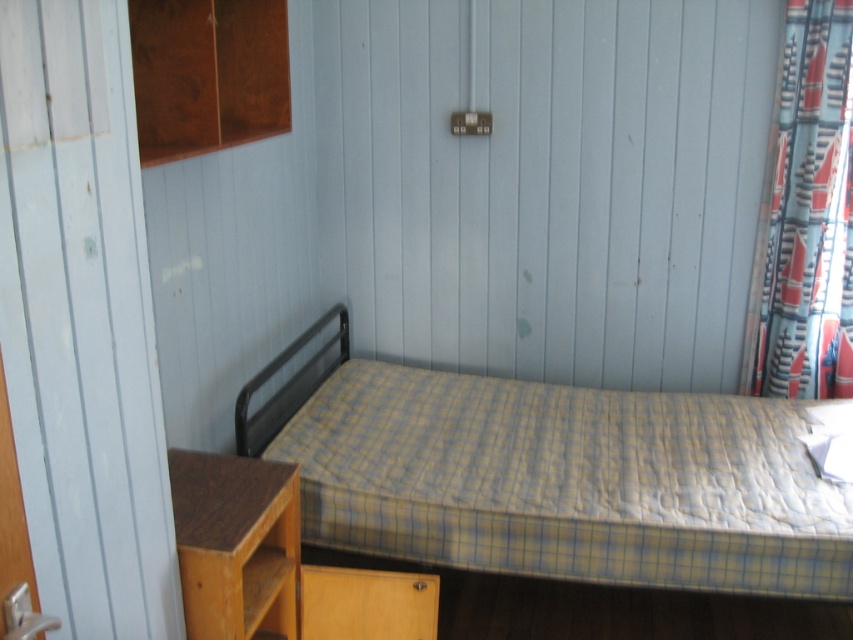
You are standing in the room and want to move from point A to point B. Point A is at coordinates point [624,440] and point B is at coordinates point [160,120]. According to the room layout, is point A behind point B or in front of it?

Answer: Point [624,440] is behind point [160,120].

You are standing in the center of the room and want to reach both the patterned fabric curtain at right and the wooden cabinet at upper left. Which object is closer to your current position?

The wooden cabinet at upper left is closer to your current position because it is located at the upper left, while the patterned fabric curtain at right is positioned to the right of it, making it farther away.

You are standing in the middle of the room and want to place a small lamp on the floor. The lamp needs to be positioned between the yellow checkered mattress at center and the patterned fabric curtain at right. Is there enough space between them for the lamp?

The yellow checkered mattress at center is in front of the patterned fabric curtain at right, so there is space between them for the lamp.